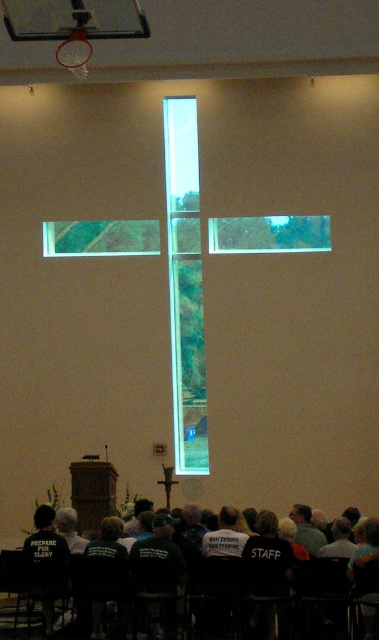
You are standing at the entrance of the church and see the clear glass cross at center and the black fabric shirt at lower center. Which object is positioned to the left when facing the front of the church?

The clear glass cross at center is to the left of the black fabric shirt at lower center when facing the front of the church.

You are standing in the church and want to place a small flower vase between the two points marked as point (195,372) and point (78,227). Since the vase needs to be closer to the viewer, which point should you position it near?

Point (195,372) is closer to the viewer than point (78,227), so you should position the flower vase near point (195,372) to ensure it is closer to the viewer.

You are standing in the church and want to find the black fabric shirt at lower center. Based on the coordinates provided, where should you look relative to the cross?

The black fabric shirt at lower center is located at coordinates point (256, 579), which places it in the lower central area of the image, near the foreground where the group of people is seated facing the cross.